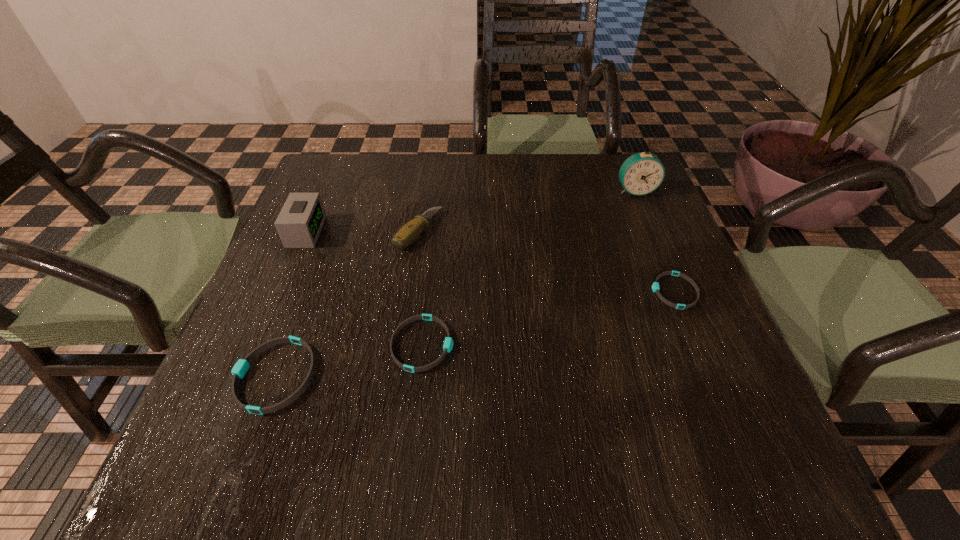
Locate an element on the screen. The image size is (960, 540). alarm clock present at the left edge is located at coordinates (299, 223).

This screenshot has width=960, height=540. Find the location of `wristband located at the right edge`. wristband located at the right edge is located at coordinates (655, 286).

Image resolution: width=960 pixels, height=540 pixels. I want to click on alarm clock situated at the right edge, so click(642, 173).

Identify the location of object at the near left corner. (239, 370).

The image size is (960, 540). In order to click on object that is at the far right corner in this screenshot , I will do `click(642, 173)`.

Image resolution: width=960 pixels, height=540 pixels. What are the coordinates of `vacant space at the far edge` in the screenshot? It's located at (499, 173).

Where is `vacant area at the near edge`? The width and height of the screenshot is (960, 540). vacant area at the near edge is located at coordinates (584, 414).

You are a GUI agent. You are given a task and a screenshot of the screen. Output one action in this format:
    pyautogui.click(x=<x>, y=<y>)
    Task: Click on the free spot at the left edge of the desktop
    The height and width of the screenshot is (540, 960).
    Given the screenshot: What is the action you would take?
    pyautogui.click(x=322, y=246)

In the image, there is a desktop. At what (x,y) coordinates should I click in order to perform the action: click on free space at the right edge. Please return your answer as a coordinate pair (x, y). This screenshot has width=960, height=540. Looking at the image, I should click on (708, 364).

At what (x,y) coordinates should I click in order to perform the action: click on free spot at the near right corner of the desktop. Please return your answer as a coordinate pair (x, y). Looking at the image, I should click on (759, 417).